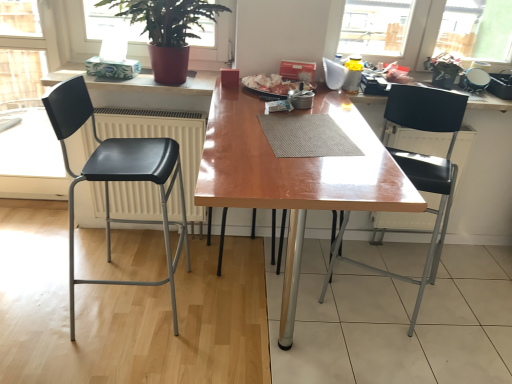
Locate an element on the screen. This screenshot has width=512, height=384. vacant space underneath black matte chair at left, which is counted as the 1th chair, starting from the left (from a real-world perspective) is located at coordinates (133, 306).